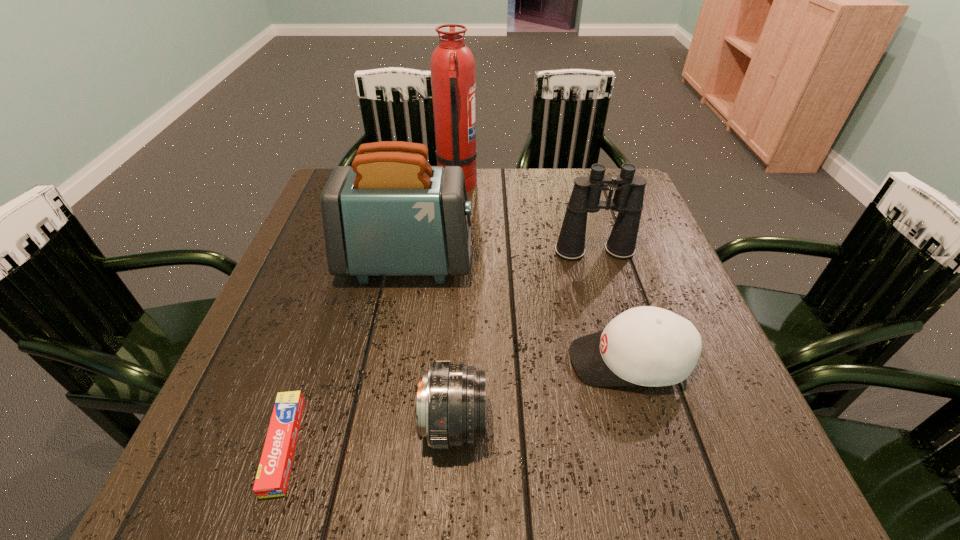
Image resolution: width=960 pixels, height=540 pixels. In order to click on the farthest object in this screenshot , I will do `click(453, 75)`.

Identify the location of fire extinguisher. (453, 75).

What are the coordinates of `the fifth shortest object` in the screenshot? It's located at (391, 214).

Where is `binoculars`? This screenshot has height=540, width=960. binoculars is located at coordinates (628, 198).

Locate an element on the screen. The width and height of the screenshot is (960, 540). telephoto lens is located at coordinates (450, 410).

You are a GUI agent. You are given a task and a screenshot of the screen. Output one action in this format:
    pyautogui.click(x=<x>, y=<y>)
    Task: Click on the baseball cap
    This screenshot has width=960, height=540.
    Given the screenshot: What is the action you would take?
    pyautogui.click(x=644, y=346)

Where is `the shortest object`? the shortest object is located at coordinates (273, 473).

Locate an element on the screen. blank space located 0.080m on the label side of the tallest object is located at coordinates (505, 186).

The width and height of the screenshot is (960, 540). In order to click on vacant space located on the front-facing side of the fifth shortest object in this screenshot , I will do `click(639, 262)`.

Identify the location of free region located 0.360m on the left of the binoculars. The width and height of the screenshot is (960, 540). (405, 252).